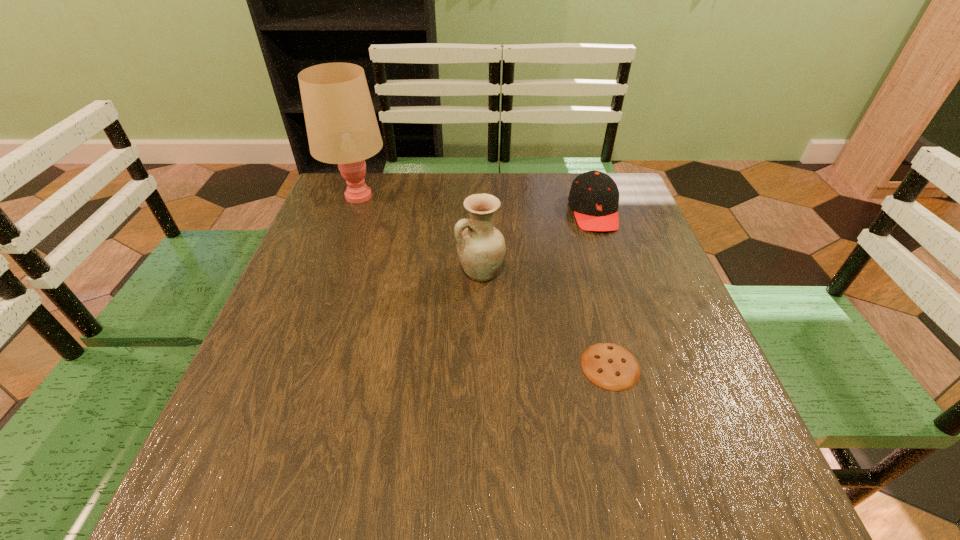
Where is `free space at the right edge`? The width and height of the screenshot is (960, 540). free space at the right edge is located at coordinates (664, 273).

In the image, there is a desktop. At what (x,y) coordinates should I click in order to perform the action: click on free space at the near left corner. Please return your answer as a coordinate pair (x, y). Looking at the image, I should click on (196, 474).

At what (x,y) coordinates should I click in order to perform the action: click on free region at the far right corner of the desktop. Please return your answer as a coordinate pair (x, y). The width and height of the screenshot is (960, 540). Looking at the image, I should click on (636, 201).

This screenshot has width=960, height=540. I want to click on vacant point located between the second nearest object and the second shortest object, so click(x=538, y=242).

Image resolution: width=960 pixels, height=540 pixels. What are the coordinates of `vacant area between the second tallest object and the cap` in the screenshot? It's located at (538, 242).

I want to click on free spot between the cookie and the cap, so click(602, 289).

You are a GUI agent. You are given a task and a screenshot of the screen. Output one action in this format:
    pyautogui.click(x=<x>, y=<y>)
    Task: Click on the free area in between the third farthest object and the third tallest object
    The height and width of the screenshot is (540, 960).
    Given the screenshot: What is the action you would take?
    pyautogui.click(x=538, y=242)

The height and width of the screenshot is (540, 960). Find the location of `vacant point located between the third shortest object and the lampshade`. vacant point located between the third shortest object and the lampshade is located at coordinates (420, 235).

The height and width of the screenshot is (540, 960). I want to click on empty space that is in between the second object from left to right and the tallest object, so click(420, 235).

This screenshot has width=960, height=540. I want to click on free point between the leftmost object and the third object from right to left, so click(x=420, y=235).